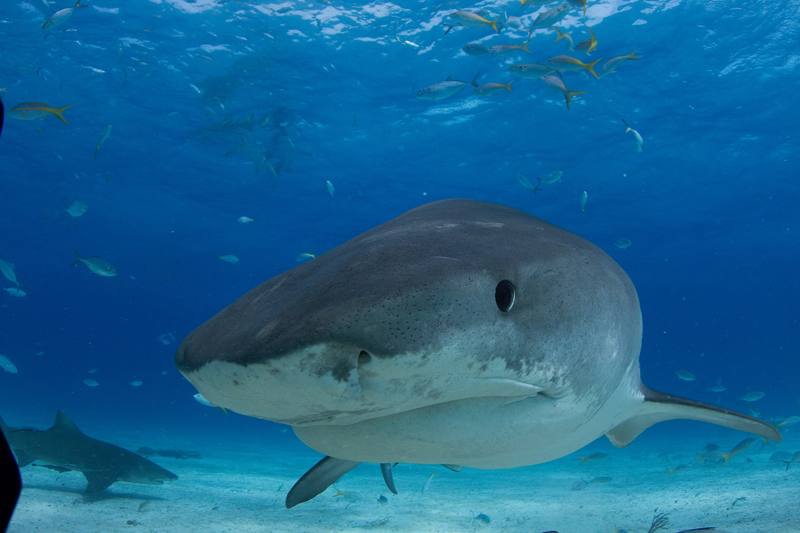
This screenshot has height=533, width=800. I want to click on surface, so click(x=409, y=21).